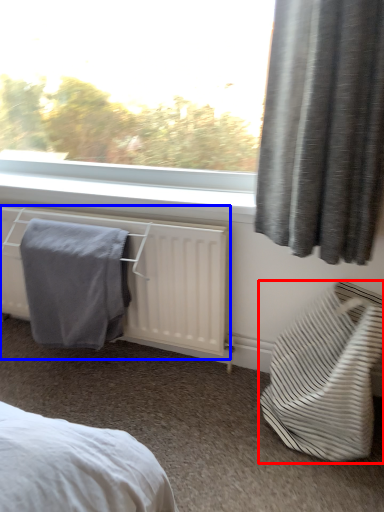
Question: Which object appears farthest to the camera in this image, furniture (highlighted by a red box) or radiator (highlighted by a blue box)?

Choices:
 (A) furniture
 (B) radiator

Answer: (B)